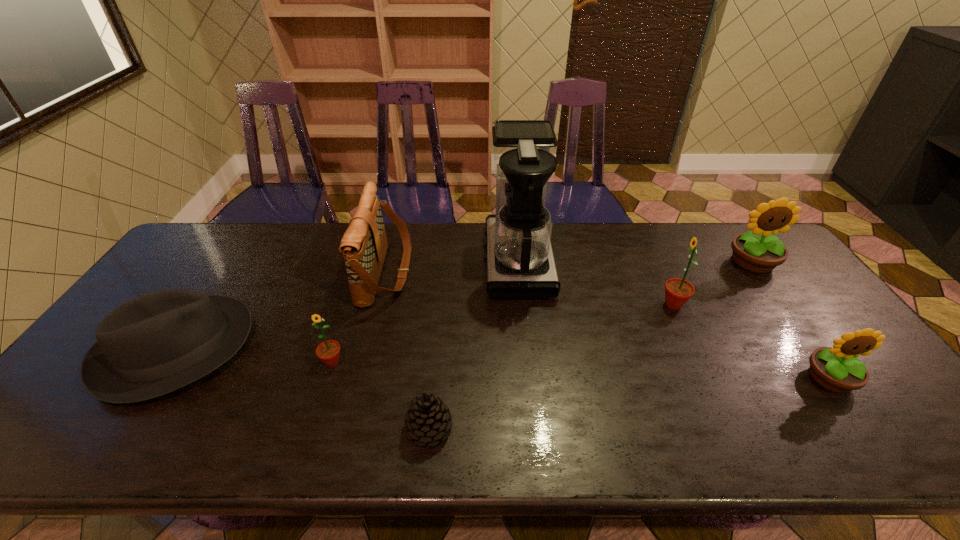
At what (x,y) coordinates should I click in order to perform the action: click on vacant point located between the pinecone and the fedora. Please return your answer as a coordinate pair (x, y). The image size is (960, 540). Looking at the image, I should click on (302, 388).

I want to click on free point between the right green sunflower and the smaller yellow sunflower, so click(x=752, y=341).

Where is `vacant area that lies between the smaller green sunflower and the nearer yellow sunflower`? vacant area that lies between the smaller green sunflower and the nearer yellow sunflower is located at coordinates (581, 370).

Locate an element on the screen. This screenshot has height=540, width=960. vacant space that is in between the shortest object and the nearer yellow sunflower is located at coordinates coord(629,403).

You are a GUI agent. You are given a task and a screenshot of the screen. Output one action in this format:
    pyautogui.click(x=<x>, y=<y>)
    Task: Click on the empty location between the bigger yellow sunflower and the left green sunflower
    
    Given the screenshot: What is the action you would take?
    pyautogui.click(x=542, y=312)

This screenshot has height=540, width=960. I want to click on the fourth closest object to the smaller green sunflower, so click(x=520, y=264).

This screenshot has height=540, width=960. I want to click on object that stands as the fifth closest to the smaller yellow sunflower, so (x=364, y=245).

Find the location of a particular element. sunflower that stands as the third closest to the smaller green sunflower is located at coordinates (759, 251).

Where is `the closest sunflower to the leftmost sunflower`? The width and height of the screenshot is (960, 540). the closest sunflower to the leftmost sunflower is located at coordinates (677, 291).

Locate an element on the screen. The height and width of the screenshot is (540, 960). vacant space that satisfies the following two spatial constraints: 1. on the face of the bigger yellow sunflower; 2. on the front-facing side of the shoulder bag is located at coordinates (759, 272).